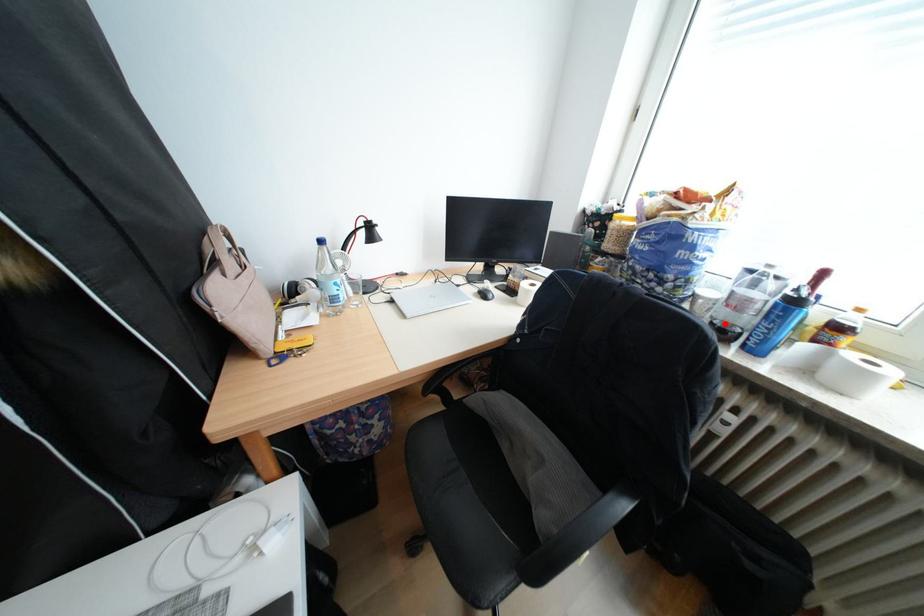
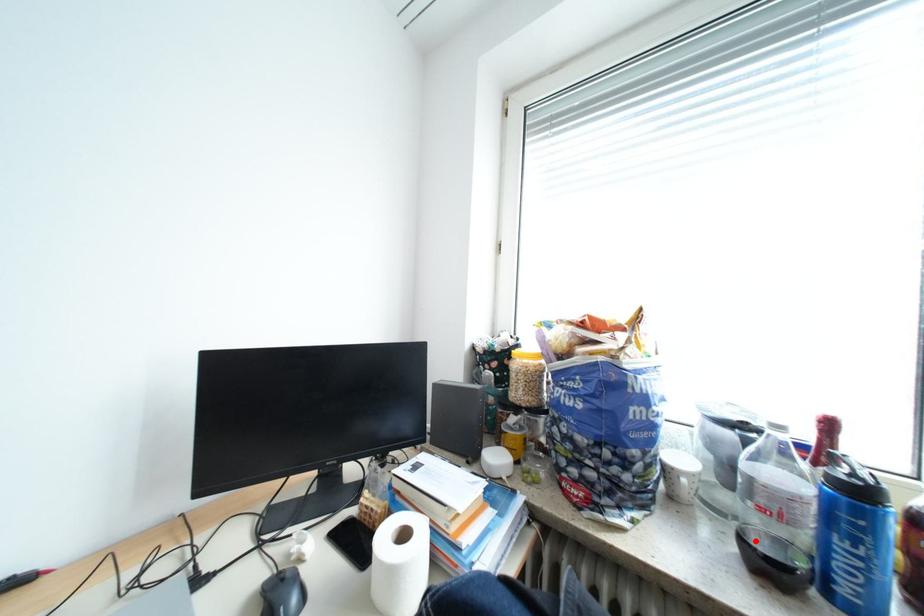
I am providing you with two images of the same scene from different viewpoints. A red point is marked on the first image and another point is marked on the second image. Are the points marked in image1 and image2 representing the same 3D position?

Yes